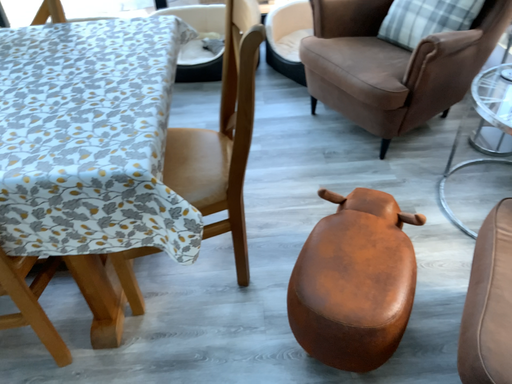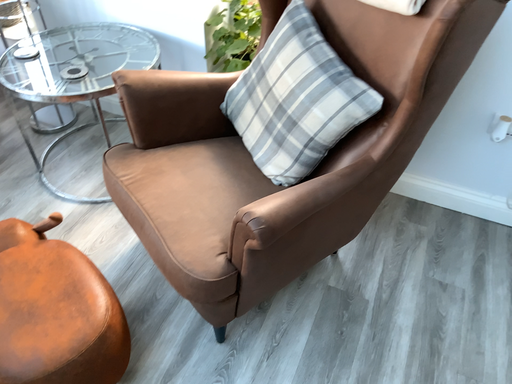
Question: Which way did the camera rotate in the video?

Choices:
 (A) rotated downward
 (B) rotated upward

Answer: (B)